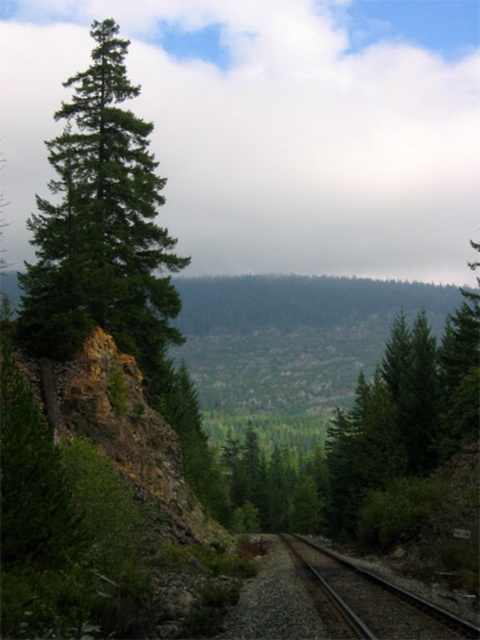
You are standing at the point marked by point (100, 224) in the image. Looking towards the railway track, which direction should you walk to reach the nearest green matte tree at left?

The point (100, 224) is already at the green matte tree at left, so you are already there.